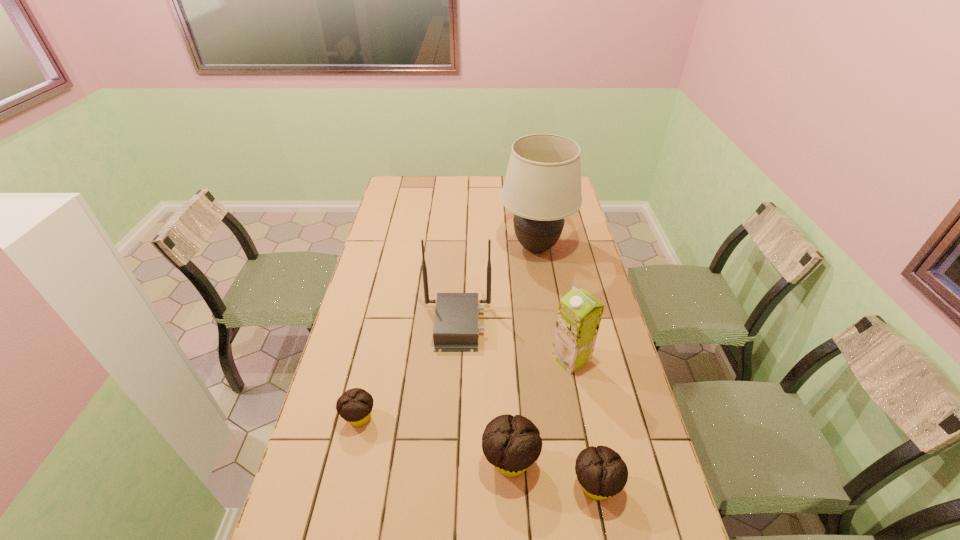
To achieve uniform spacing by inserting another muffin among them, please point to a free space for this new muffin. Please provide its 2D coordinates. Your answer should be formatted as a tuple, i.e. [(x, y)], where the tuple contains the x and y coordinates of a point satisfying the conditions above.

[(432, 438)]